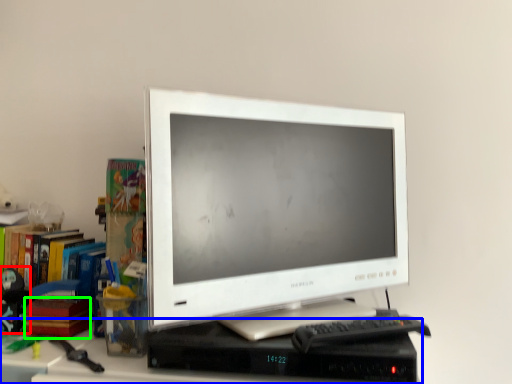
Question: Which is farther away from toy (highlighted by a red box)? computer desk (highlighted by a blue box) or paperback book (highlighted by a green box)?

Choices:
 (A) computer desk
 (B) paperback book

Answer: (A)